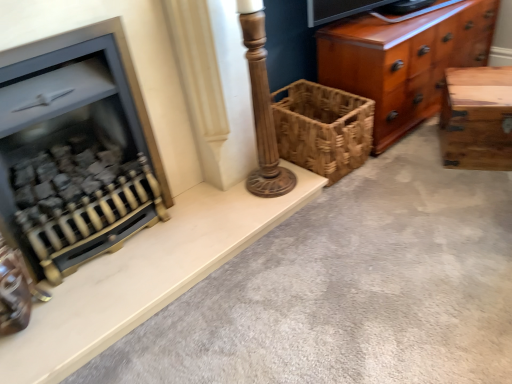
Question: From their relative heights in the image, would you say natural wood trunk at right is taller or shorter than woven brown basket at center?

Choices:
 (A) tall
 (B) short

Answer: (B)

Question: From the image's perspective, is natural wood trunk at right located above or below woven brown basket at center?

Choices:
 (A) above
 (B) below

Answer: (A)

Question: Which object is positioned closest to the matte black fireplace at left?

Choices:
 (A) white marble fireplace at left
 (B) natural wood trunk at right
 (C) shiny brown wood chest of drawers at right
 (D) woven brown basket at center
 (E) wooden column at center

Answer: (A)

Question: Which object is positioned closest to the white marble fireplace at left?

Choices:
 (A) natural wood trunk at right
 (B) woven brown basket at center
 (C) wooden column at center
 (D) shiny brown wood chest of drawers at right
 (E) matte black fireplace at left

Answer: (E)